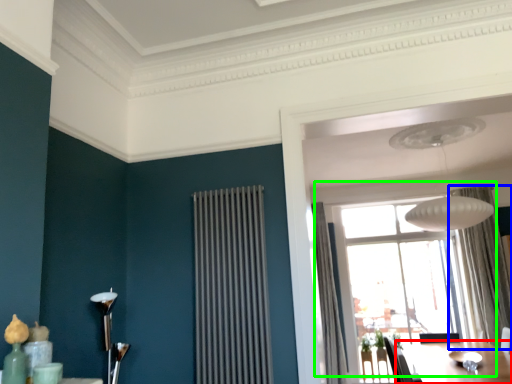
Question: Which object is positioned closest to table (highlighted by a red box)? Select from curtain (highlighted by a blue box) and window (highlighted by a green box).

Choices:
 (A) curtain
 (B) window

Answer: (A)